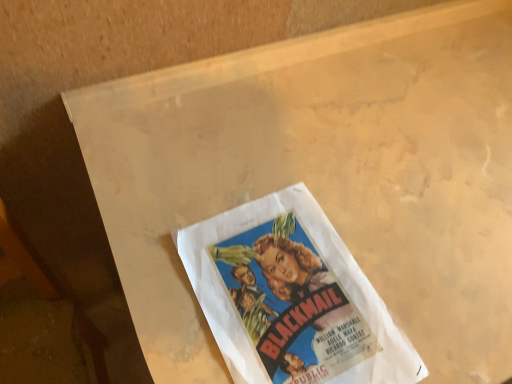
The image size is (512, 384). In order to click on vacant space to the right of matte paper poster at center in this screenshot , I will do `click(438, 272)`.